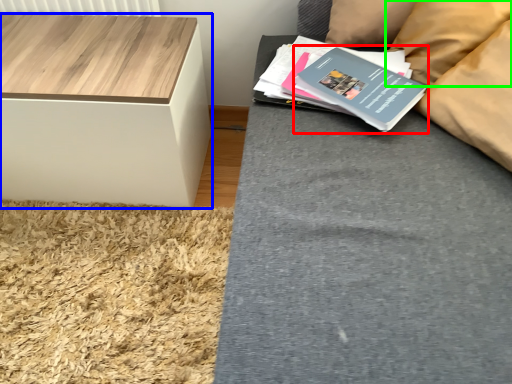
Question: Which is nearer to the paperback book (highlighted by a red box)? table (highlighted by a blue box) or pillow (highlighted by a green box).

Choices:
 (A) table
 (B) pillow

Answer: (B)